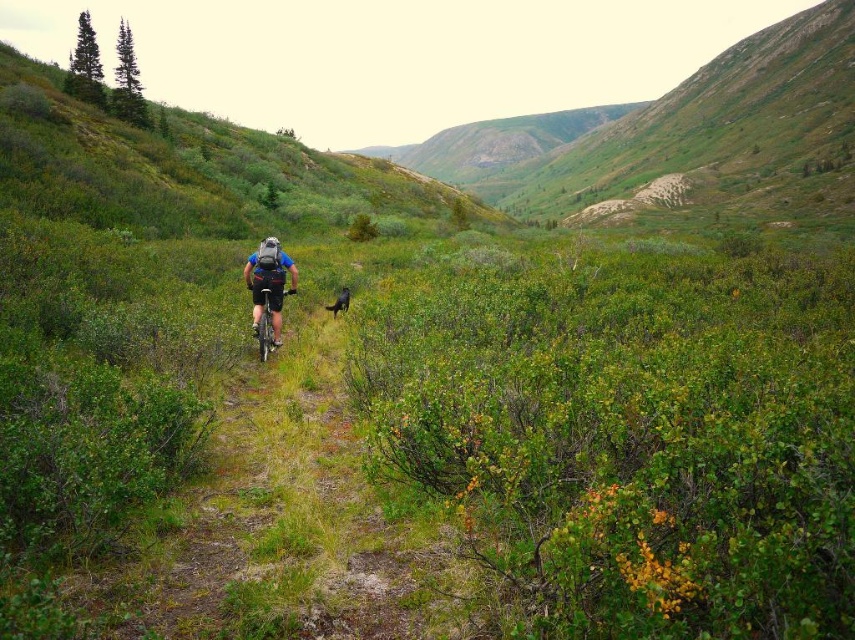
You are a hiker who wants to take a photo of the shiny metallic bicycle at center and the shiny black dog at center. Which object should you focus on first to ensure both are in the frame?

You should focus on the shiny metallic bicycle at center first because it is closer to the viewer than the shiny black dog at center, so adjusting the focus starting from the closer object will help capture both in the frame.

Consider the image. You are a photographer trying to capture a clear photo of the blue matte bicycle at center and the shiny black dog at center. Since you want to focus on the bicycle, which object should you adjust your camera lens to ensure it is in focus first, considering their sizes?

The blue matte bicycle at center is shorter than the shiny black dog at center, so you should focus on the bicycle first as it is smaller and closer to the lens.

You are a hiker who wants to ride a bicycle along the trail. You see a blue matte bicycle at center and a shiny metallic bicycle at center. Which bicycle is positioned higher in the image?

The blue matte bicycle at center is above the shiny metallic bicycle at center, so it is positioned higher in the image.